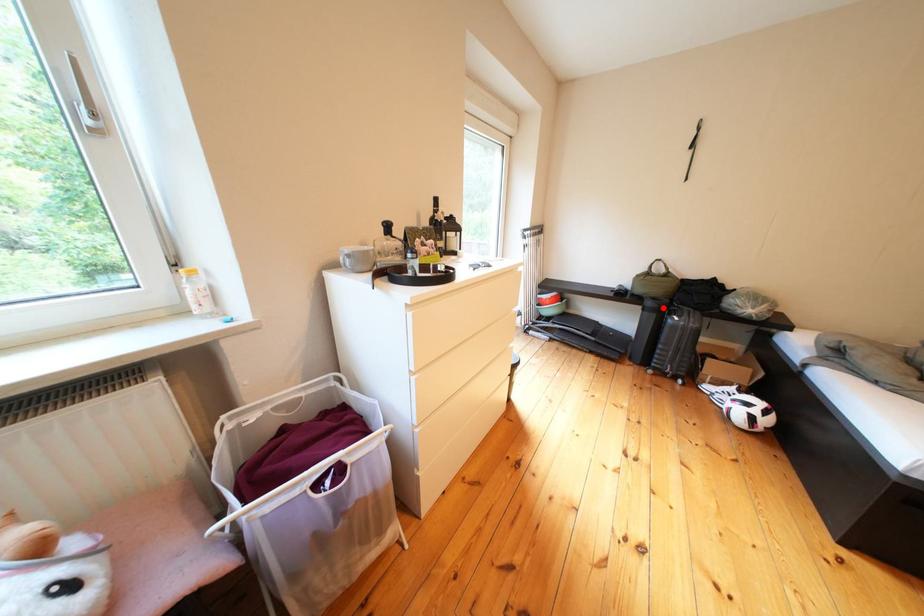
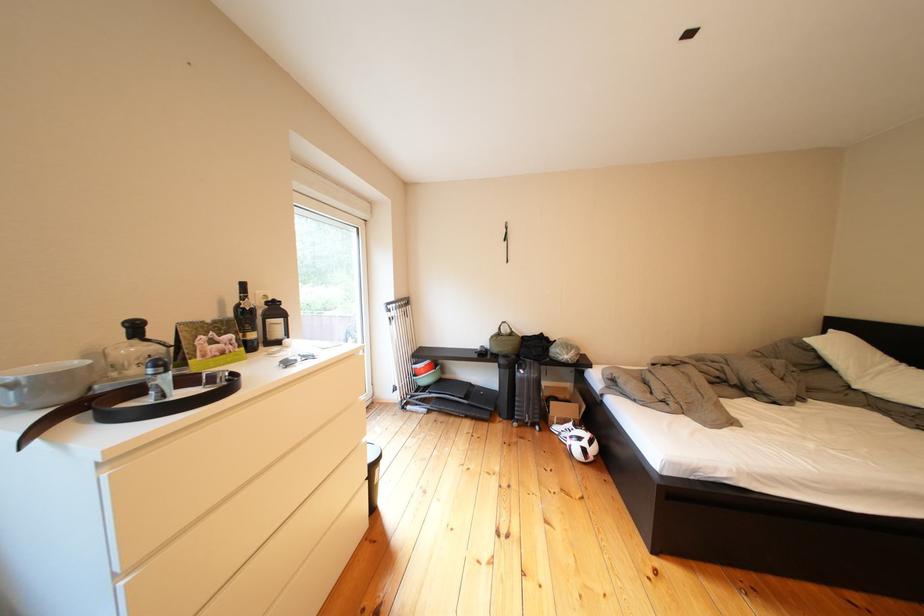
The point at the highlighted location is marked in the first image. Where is the corresponding point in the second image?

(516, 366)